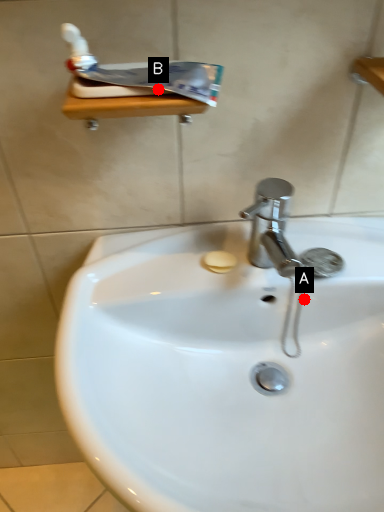
Question: Two points are circled on the image, labeled by A and B beside each circle. Which point is closer to the camera?

Choices:
 (A) A is closer
 (B) B is closer

Answer: (B)